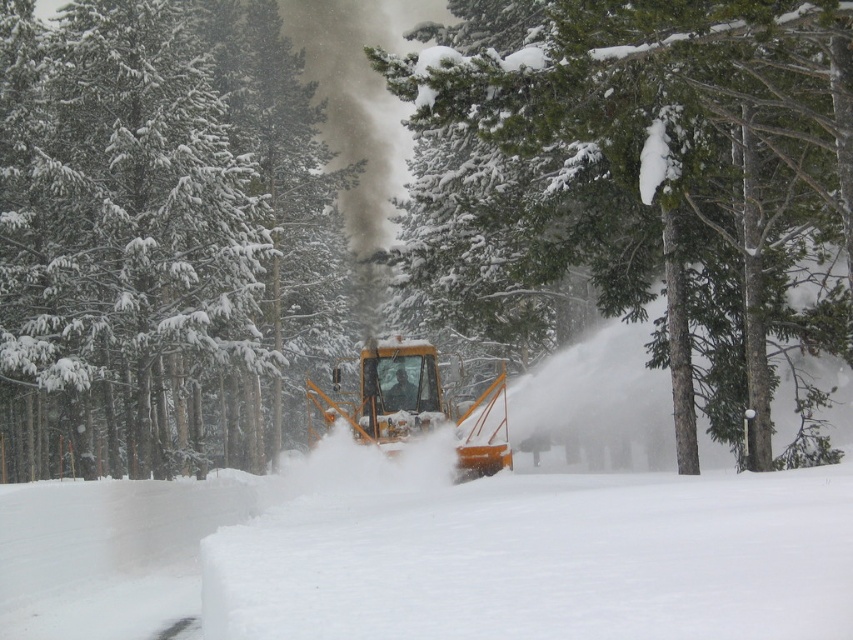
You are a passenger in the yellow metallic snowplow at center. You notice a green textured pine tree at center through the windshield. Is the tree blocking your view of the road ahead?

The green textured pine tree at center is in front of the yellow metallic snowplow at center, so it is blocking the view of the road ahead.